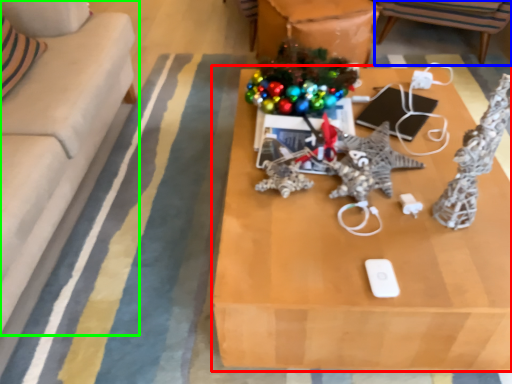
Question: Which object is positioned closest to table (highlighted by a red box)? Select from chair (highlighted by a blue box) and studio couch (highlighted by a green box).

Choices:
 (A) chair
 (B) studio couch

Answer: (B)